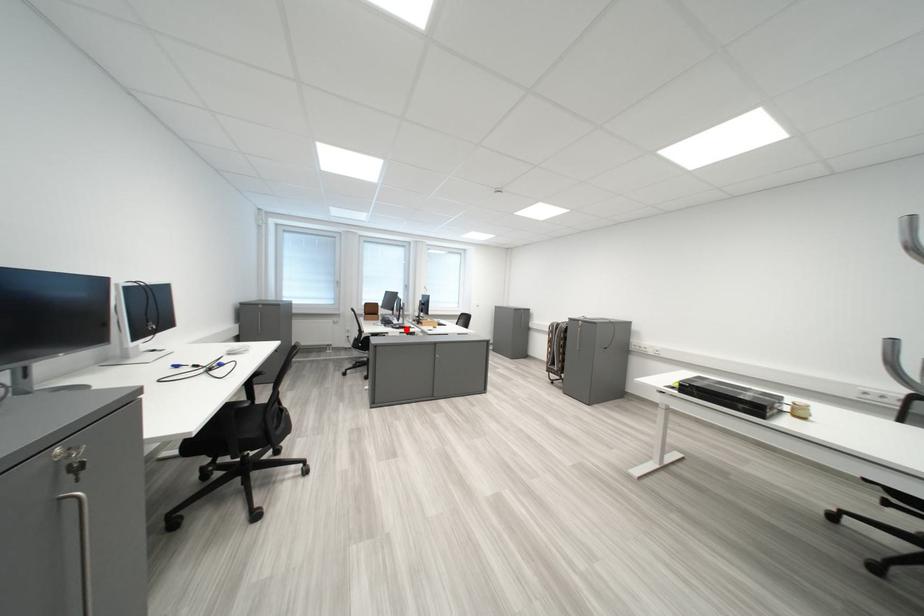
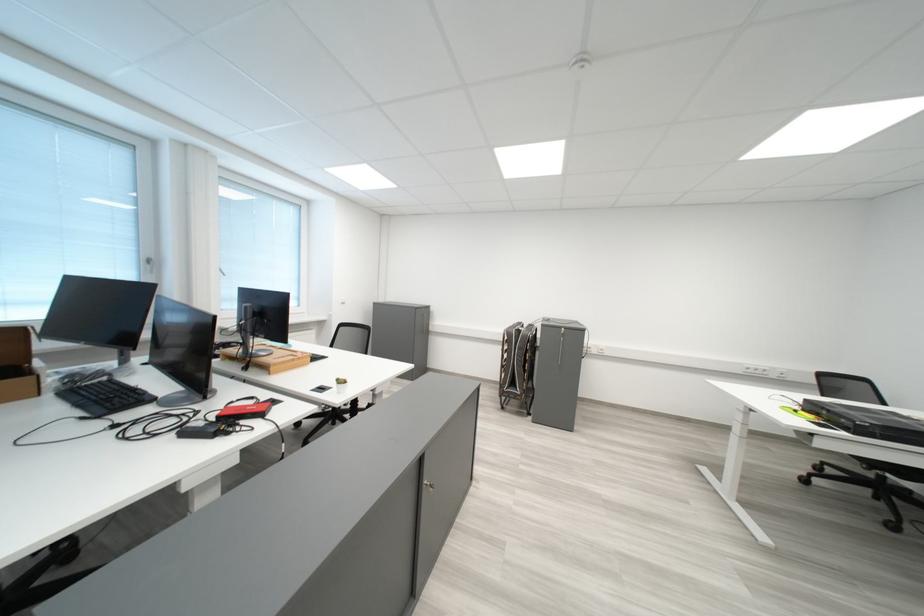
Locate, in the second image, the point that corresponds to the highlighted location in the first image.

(200, 436)